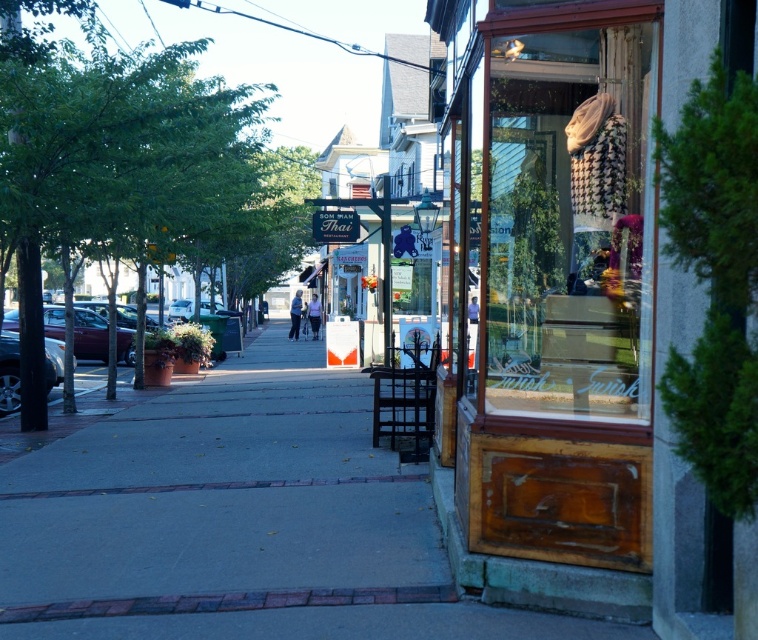
Does wooden display case at center have a greater height compared to shiny maroon sedan at left?

Indeed, wooden display case at center has a greater height compared to shiny maroon sedan at left.

Between wooden display case at center and shiny maroon sedan at left, which one is positioned higher?

wooden display case at center is higher up.

Who is more distant from viewer, (644, 403) or (61, 308)?

The point (61, 308) is more distant.

Identify the location of wooden display case at center. (568, 225).